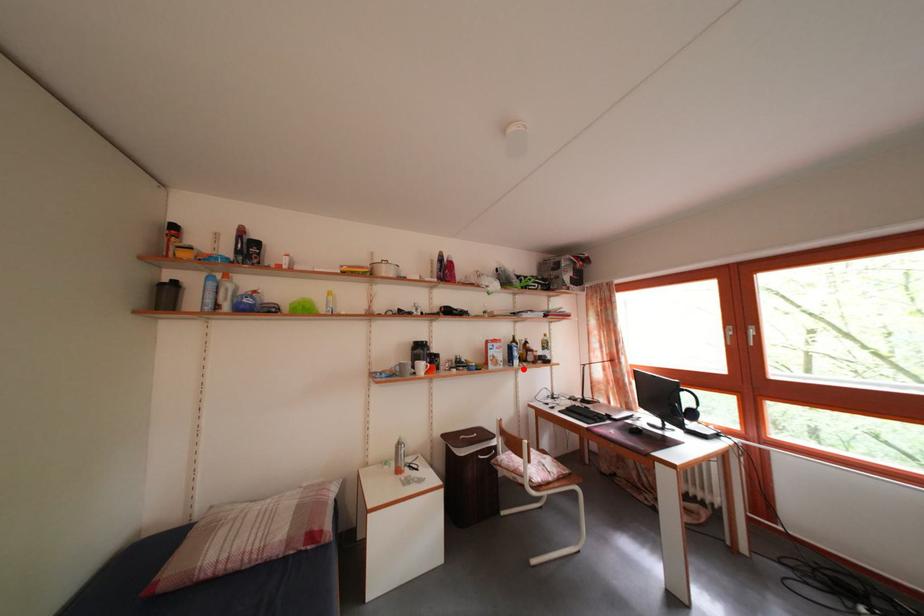
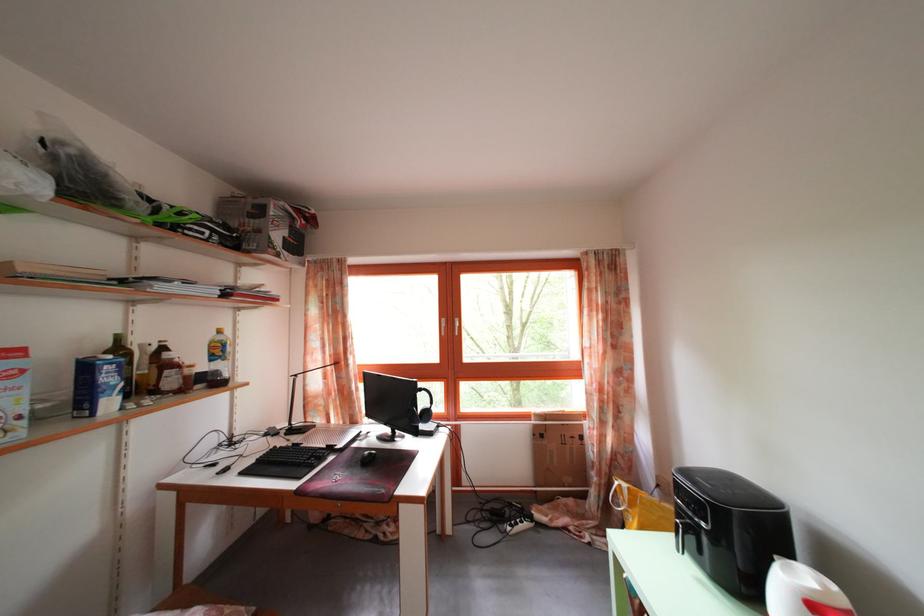
Question: I am providing you with two images of the same scene from different viewpoints. A red point is marked on the first image. At the location where the point appears in image 1, is it still visible in image 2?

Choices:
 (A) Yes
 (B) No

Answer: (A)